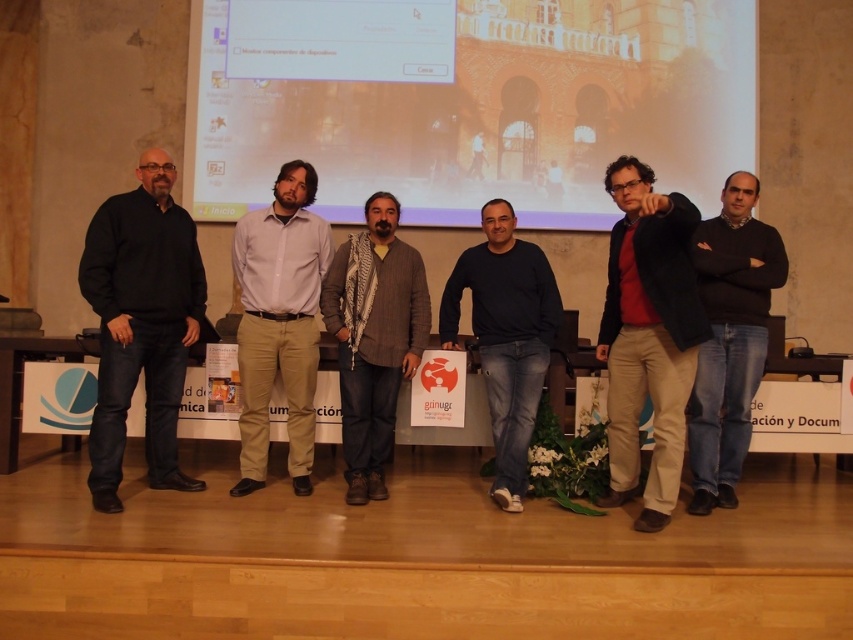
Is point (672, 264) positioned in front of point (428, 307)?

Yes.

Which is above, matte black sweater at center or gray wool scarf at center?

Positioned higher is matte black sweater at center.

Between point (614, 344) and point (328, 310), which one is positioned in front?

Point (614, 344)

Find the location of `matte black sweater at center`. matte black sweater at center is located at coordinates (648, 336).

Between black matte sweater at left and dark blue sweater at center, which one is positioned lower?

dark blue sweater at center is below.

Locate an element on the screen. This screenshot has height=640, width=853. black matte sweater at left is located at coordinates (141, 323).

Does point (329, 84) lie behind point (477, 336)?

Yes, it is.

Does point (595, 180) lie behind point (535, 272)?

That is True.

Where is `matte projector screen at upper center`? The image size is (853, 640). matte projector screen at upper center is located at coordinates (466, 102).